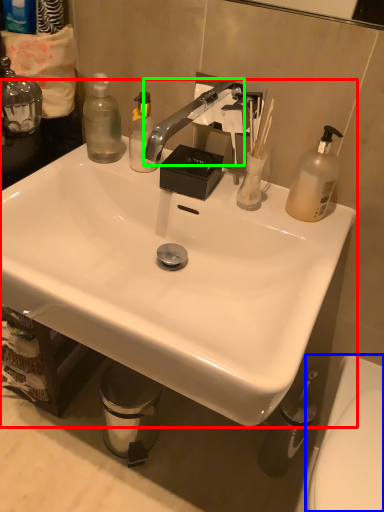
Question: Which is farther away from sink (highlighted by a red box)? toilet (highlighted by a blue box) or faucet (highlighted by a green box)?

Choices:
 (A) toilet
 (B) faucet

Answer: (A)